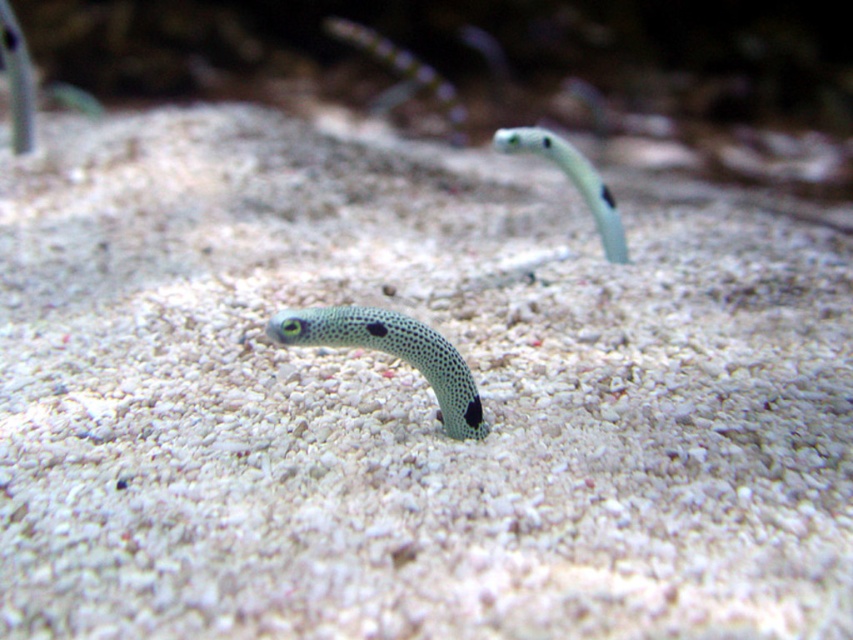
Question: Does speckled green snake at center appear under green spotted snake at center?

Choices:
 (A) no
 (B) yes

Answer: (B)

Question: From the image, what is the correct spatial relationship of speckled green snake at center in relation to green spotted snake at center?

Choices:
 (A) above
 (B) below

Answer: (B)

Question: Which of the following is the farthest from the observer?

Choices:
 (A) (531, 150)
 (B) (444, 420)

Answer: (A)

Question: Considering the relative positions of speckled green snake at center and green spotted snake at center in the image provided, where is speckled green snake at center located with respect to green spotted snake at center?

Choices:
 (A) left
 (B) right

Answer: (A)

Question: Which point is farther to the camera?

Choices:
 (A) green spotted snake at center
 (B) speckled green snake at center

Answer: (A)

Question: Among these objects, which one is farthest from the camera?

Choices:
 (A) green spotted snake at center
 (B) speckled green snake at center

Answer: (A)